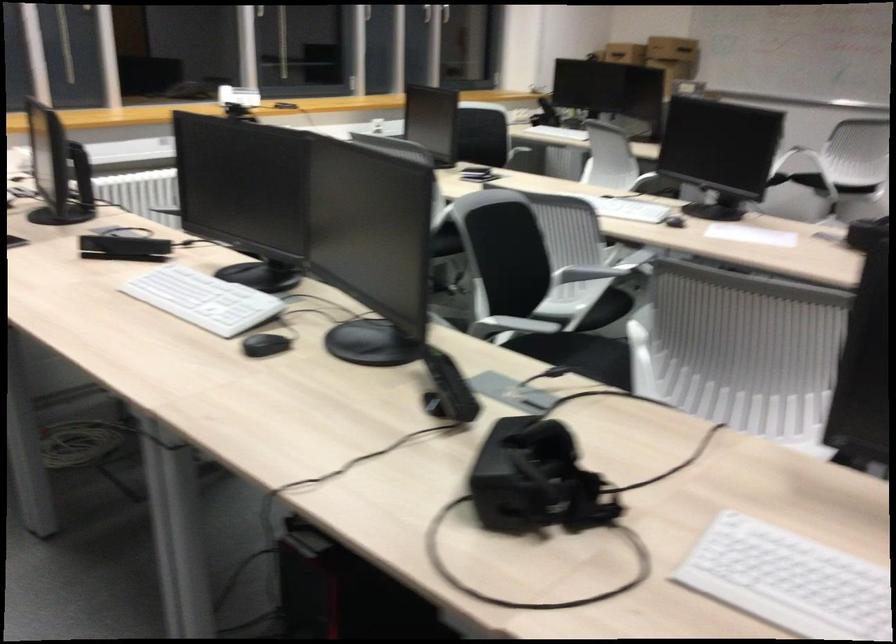
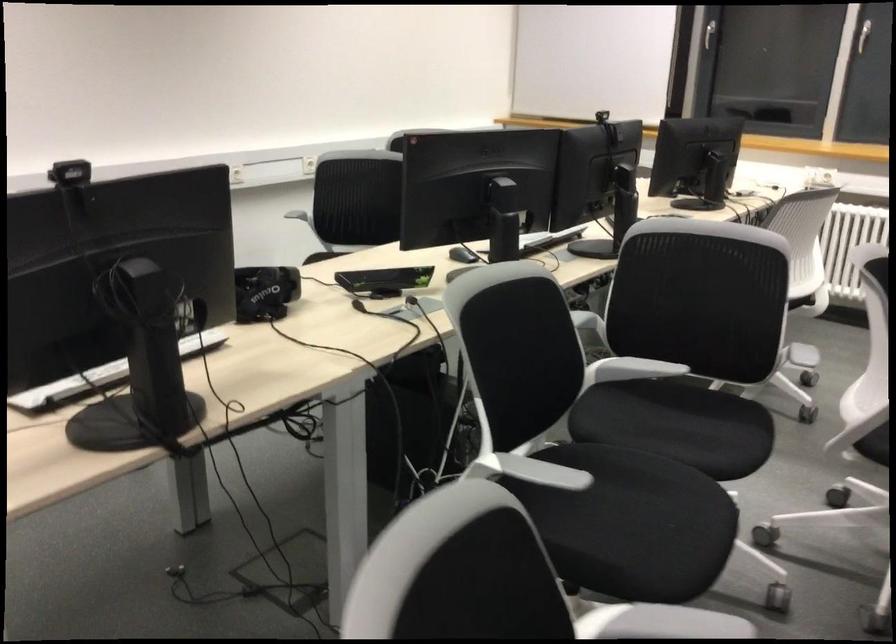
The point at (586, 324) is marked in the first image. Where is the corresponding point in the second image?

(874, 444)